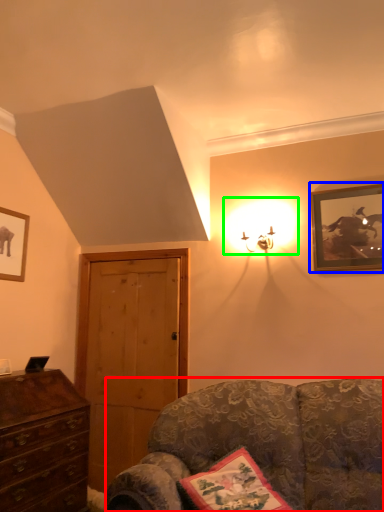
Question: Which is farther away from studio couch (highlighted by a red box)? picture frame (highlighted by a blue box) or light (highlighted by a green box)?

Choices:
 (A) picture frame
 (B) light

Answer: (B)